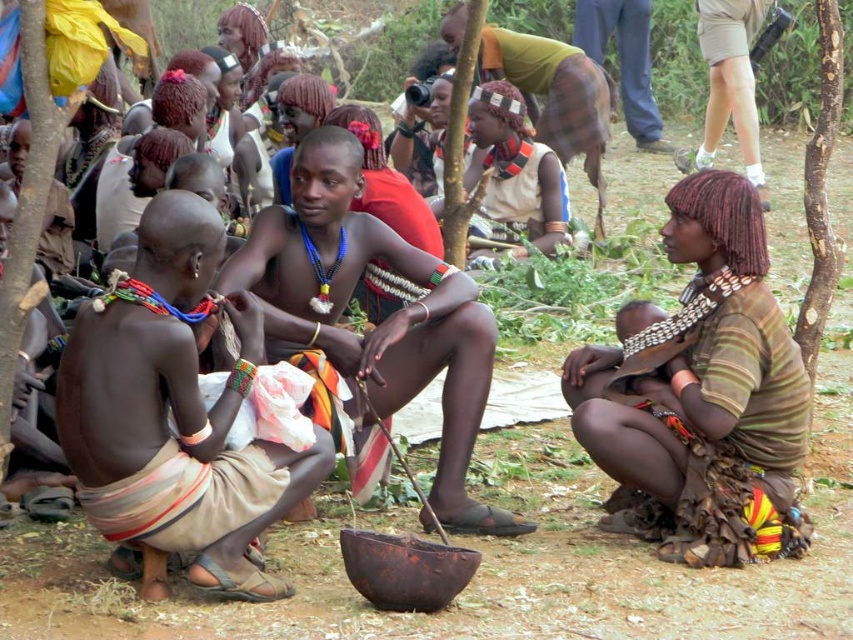
Question: Which point is closer to the camera taking this photo?

Choices:
 (A) (752, 109)
 (B) (189, 488)
 (C) (320, 317)

Answer: (B)

Question: Can you confirm if brown textured fabric at center is thinner than khaki shorts at upper right?

Choices:
 (A) yes
 (B) no

Answer: (B)

Question: From the image, what is the correct spatial relationship of matte brown shirt at center in relation to khaki shorts at upper right?

Choices:
 (A) left
 (B) right

Answer: (A)

Question: Can you confirm if brown textured fabric at center is bigger than brown skin/scarred man at center?

Choices:
 (A) no
 (B) yes

Answer: (B)

Question: Estimate the real-world distances between objects in this image. Which object is closer to the khaki shorts at upper right?

Choices:
 (A) matte brown shirt at center
 (B) brown textured fabric at center
 (C) brown skin/scarred man at center

Answer: (A)

Question: Which object is farther from the camera taking this photo?

Choices:
 (A) brown textured fabric at center
 (B) brown skin/scarred man at center

Answer: (A)